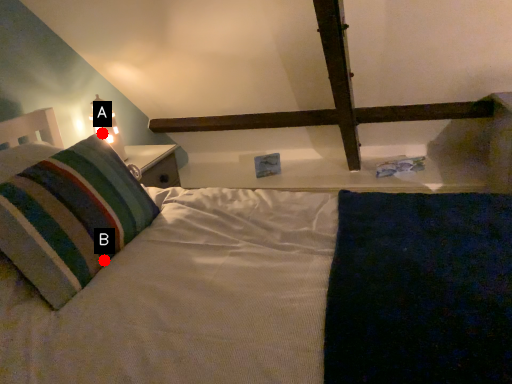
Question: Two points are circled on the image, labeled by A and B beside each circle. Which point appears farthest from the camera in this image?

Choices:
 (A) A is further
 (B) B is further

Answer: (A)